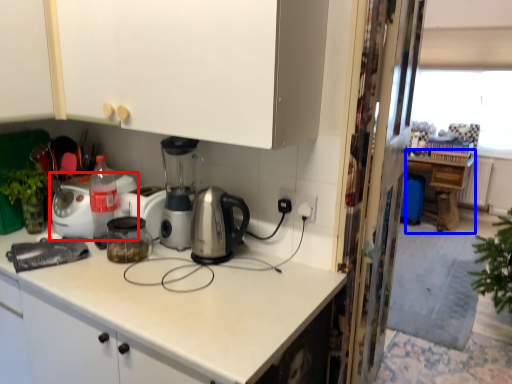
Question: Which of the following is the closest to the observer, home appliance (highlighted by a red box) or table (highlighted by a blue box)?

Choices:
 (A) home appliance
 (B) table

Answer: (A)